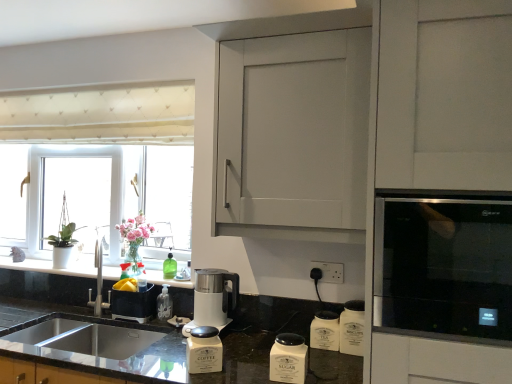
Question: Is point (278, 339) closer or farther from the camera than point (187, 120)?

Choices:
 (A) closer
 (B) farther

Answer: (A)

Question: Considering the relative positions of white matte sugar container at lower center, the fourth appliance viewed from the left, and white plastic window at left in the image provided, is white matte sugar container at lower center, the fourth appliance viewed from the left, to the left or to the right of white plastic window at left?

Choices:
 (A) left
 (B) right

Answer: (B)

Question: Which of these objects is positioned farthest from the matte white cabinet at upper center?

Choices:
 (A) stainless steel microwave at right
 (B) translucent plastic soap dispenser at lower center, which is the second appliance in left-to-right order
 (C) stainless steel sink at lower left
 (D) white ceramic canisters at lower center, which is the fifth appliance from left to right
 (E) black granite sink at lower left, the first countertop when ordered from top to bottom

Answer: (E)

Question: Based on their relative distances, which object is farther from the matte white cabinet at upper center?

Choices:
 (A) white matte biscuit jar at lower center, the 1th appliance from the right
 (B) white matte sugar container at lower center, the fourth appliance viewed from the left
 (C) matte black container at lower left, the first appliance when ordered from left to right
 (D) stainless steel microwave at right
 (E) white plastic window at left

Answer: (C)